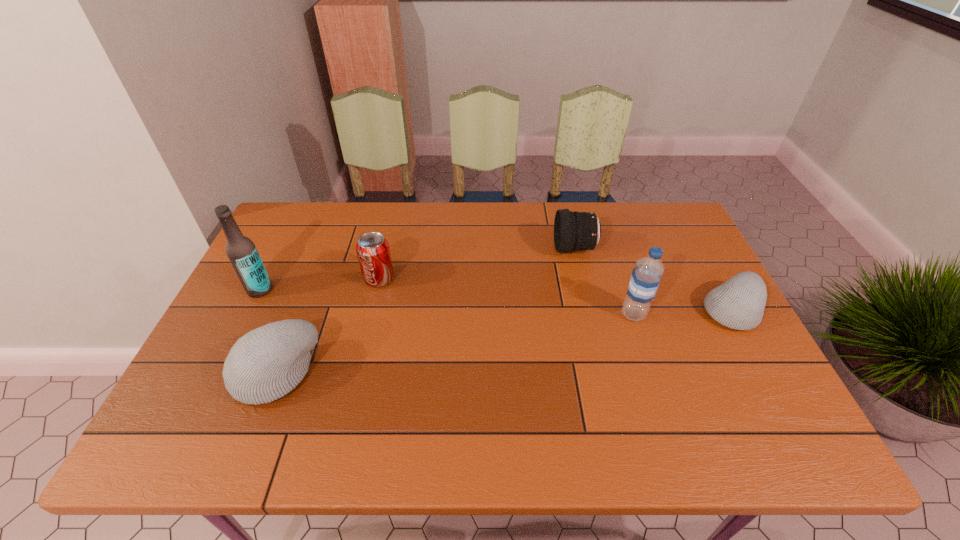
To ensure equal spacing by inserting another beanie among them, please point out a vacant spot for this new beanie. Please provide its 2D coordinates. Your answer should be formatted as a tuple, i.e. [(x, y)], where the tuple contains the x and y coordinates of a point satisfying the conditions above.

[(517, 340)]